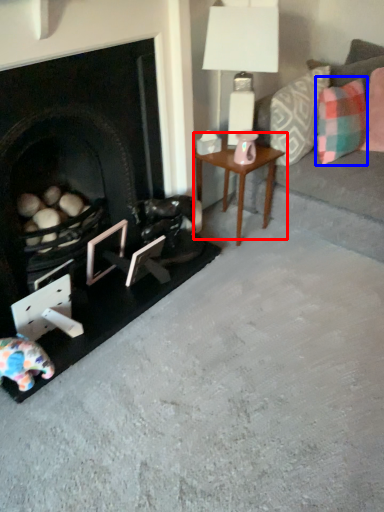
Question: Among these objects, which one is farthest to the camera, table (highlighted by a red box) or pillow (highlighted by a blue box)?

Choices:
 (A) table
 (B) pillow

Answer: (A)